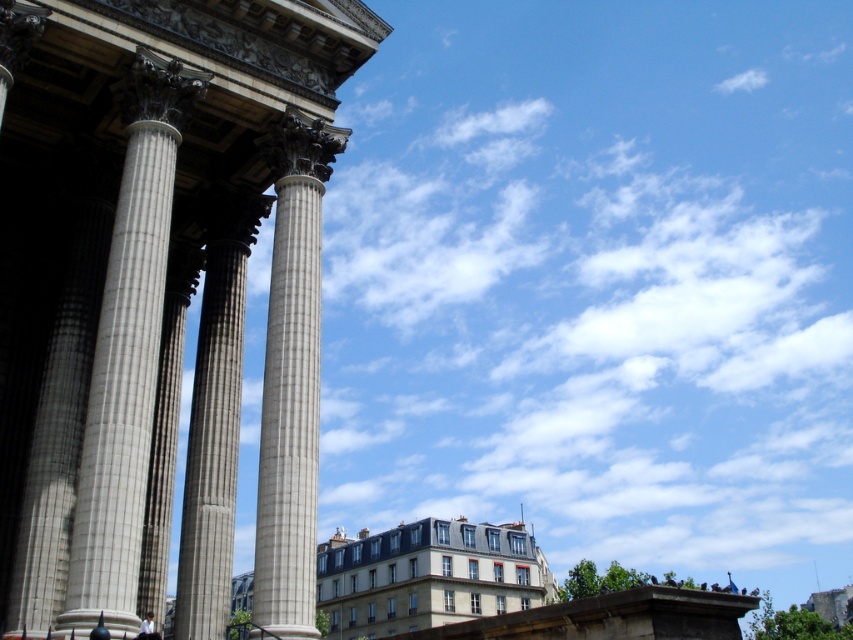
Question: Which point appears farthest from the camera in this image?

Choices:
 (A) (344, 145)
 (B) (125, 186)

Answer: (A)

Question: Can you confirm if white marble column at left is smaller than smooth stone column at center?

Choices:
 (A) no
 (B) yes

Answer: (A)

Question: Which point appears farthest from the camera in this image?

Choices:
 (A) (212, 604)
 (B) (309, 122)
 (C) (106, 509)

Answer: (B)

Question: Does white marble column at left have a larger size compared to gray stone column at center?

Choices:
 (A) no
 (B) yes

Answer: (B)

Question: Does white marble column at left appear on the right side of smooth stone column at center?

Choices:
 (A) no
 (B) yes

Answer: (A)

Question: Which of the following is the closest to the observer?

Choices:
 (A) (270, 410)
 (B) (102, 589)

Answer: (B)